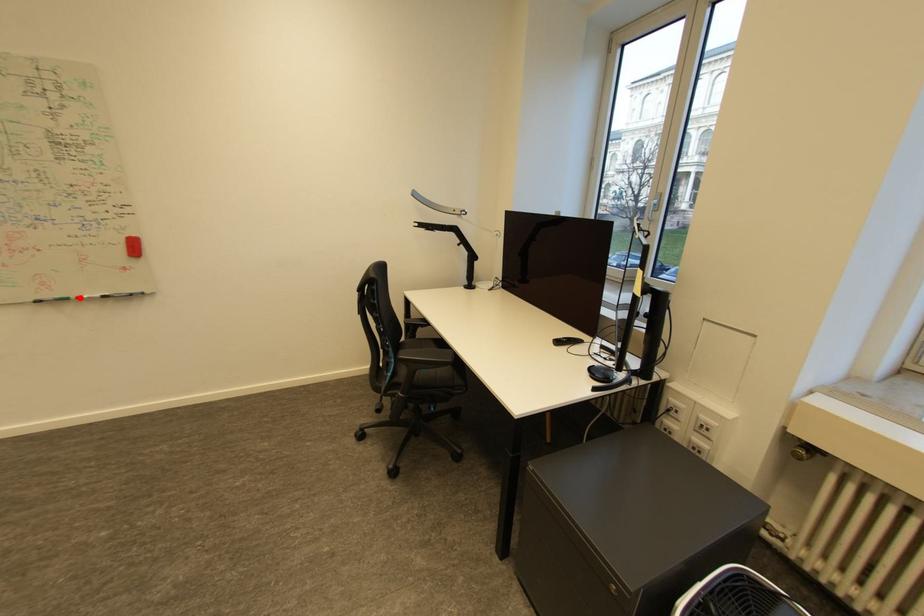
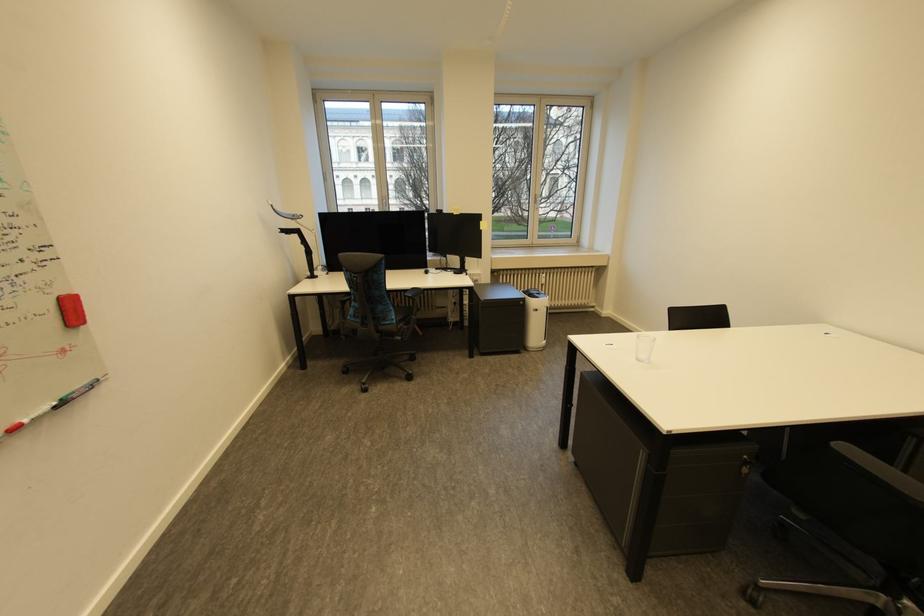
Where in the second image is the point corresponding to the highlighted location from the first image?

(6, 436)